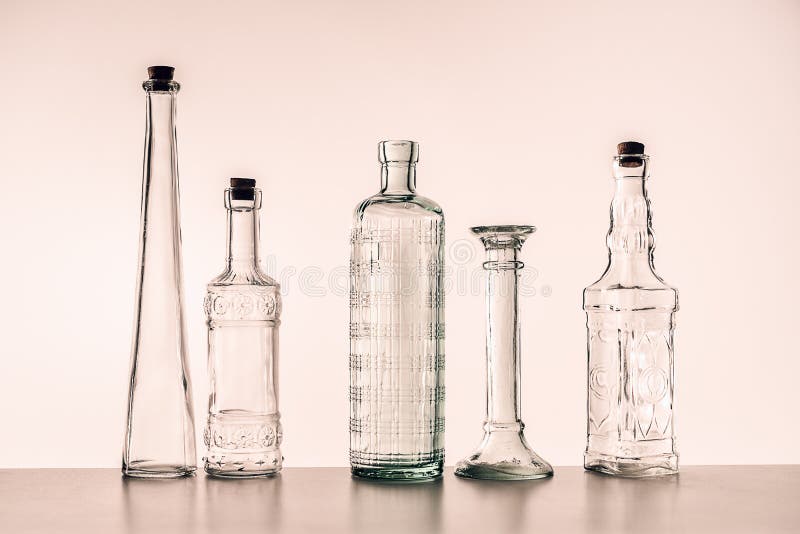
Locate an element on the screen. Image resolution: width=800 pixels, height=534 pixels. long and thing glass bottles is located at coordinates (148, 356), (505, 356).